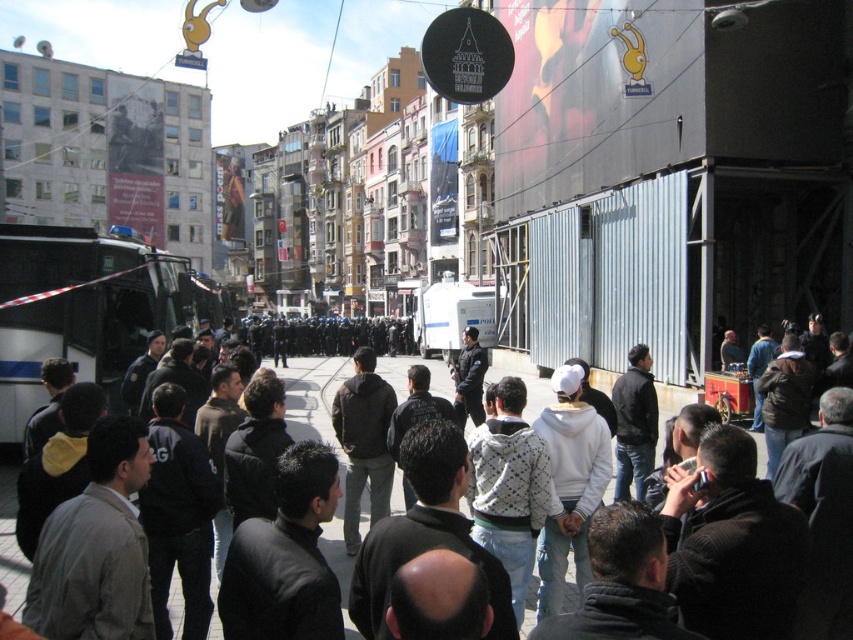
Can you confirm if brushed metal bus at left is smaller than dark gray jacket at center?

Yes.

This screenshot has width=853, height=640. I want to click on brushed metal bus at left, so click(x=82, y=308).

Where is `brushed metal bus at left`? The width and height of the screenshot is (853, 640). brushed metal bus at left is located at coordinates (82, 308).